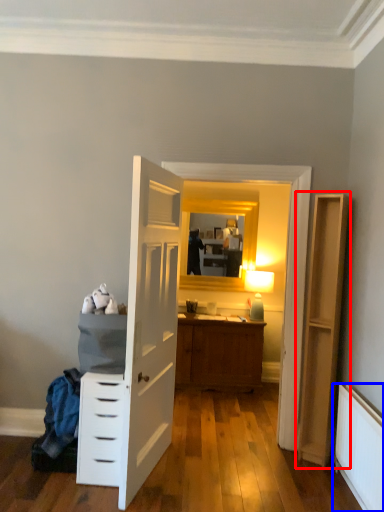
Question: Among these objects, which one is farthest to the camera, file cabinet (highlighted by a red box) or radiator (highlighted by a blue box)?

Choices:
 (A) file cabinet
 (B) radiator

Answer: (A)